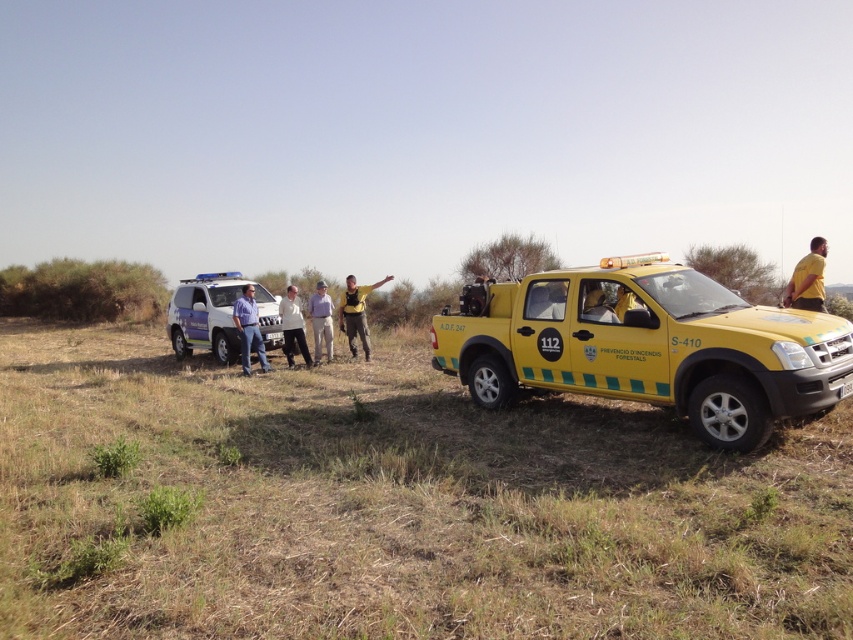
Question: Estimate the real-world distances between objects in this image. Which object is closer to the yellow matte shirt at upper right?

Choices:
 (A) blue shirt at center
 (B) yellow matte pickup truck at center

Answer: (B)

Question: Does brown grassy dirt field at lower center lie behind light brown leather jacket at center?

Choices:
 (A) yes
 (B) no

Answer: (B)

Question: Based on their relative distances, which object is farther from the blue shirt at center?

Choices:
 (A) white fabric pants at center
 (B) yellow matte pickup truck at center

Answer: (B)

Question: Is brown grassy dirt field at lower center wider than white fabric pants at center?

Choices:
 (A) yes
 (B) no

Answer: (A)

Question: Estimate the real-world distances between objects in this image. Which object is closer to the yellow matte shirt at upper right?

Choices:
 (A) brown grassy dirt field at lower center
 (B) light brown leather jacket at center
 (C) blue metallic jeep at center
 (D) yellow fabric shirt at center

Answer: (A)

Question: Is yellow matte pickup truck at center thinner than yellow fabric shirt at center?

Choices:
 (A) yes
 (B) no

Answer: (B)